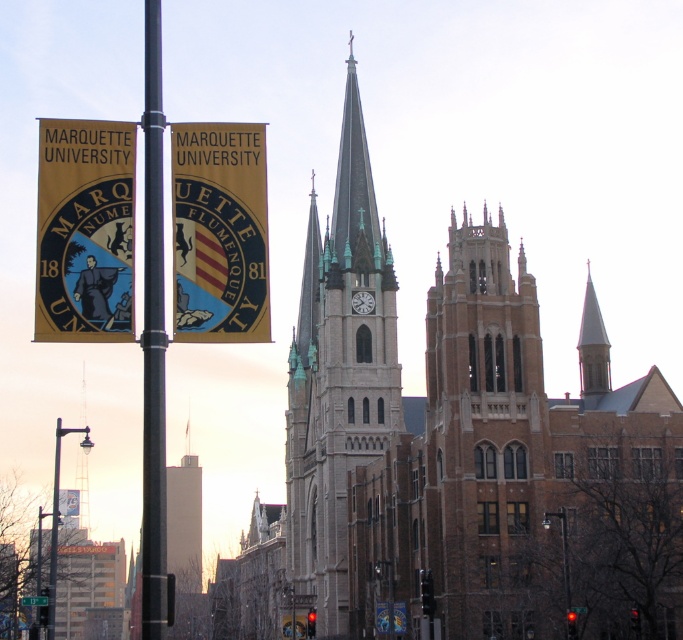
Measure the distance between black metal pole at center and metallic streetlight at lower left.

A distance of 37.77 meters exists between black metal pole at center and metallic streetlight at lower left.

Image resolution: width=683 pixels, height=640 pixels. Describe the element at coordinates (153, 340) in the screenshot. I see `black metal pole at center` at that location.

I want to click on black metal pole at center, so click(153, 340).

Find the location of `black metal pole at center`. black metal pole at center is located at coordinates (153, 340).

Does white stone tower at center have a greater width compared to black metal pole at center?

Indeed, white stone tower at center has a greater width compared to black metal pole at center.

Is point (324, 436) less distant than point (158, 618)?

No, it is not.

Find the location of a particular element. Image resolution: width=683 pixels, height=640 pixels. white stone tower at center is located at coordinates (337, 380).